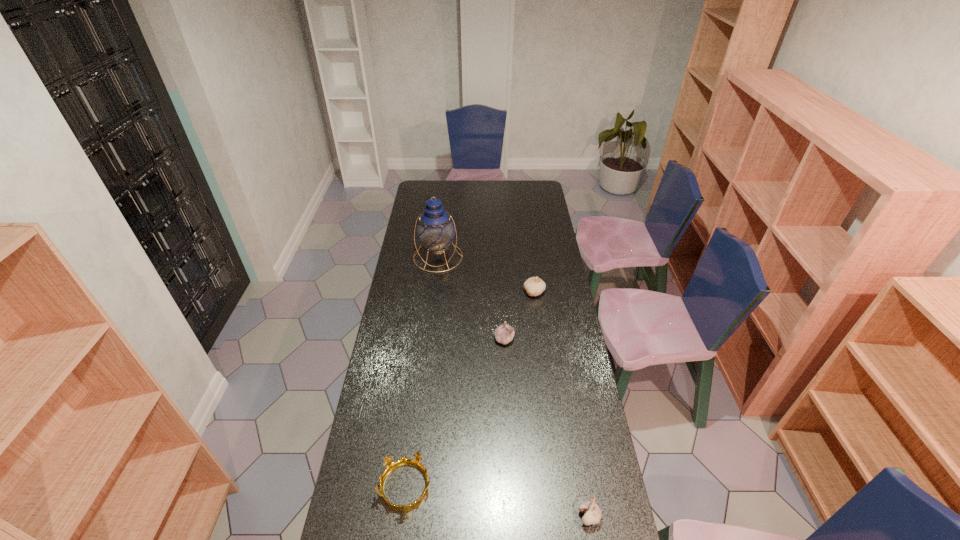
Select which object appears as the third closest to the crown. Please provide its 2D coordinates. Your answer should be formatted as a tuple, i.e. [(x, y)], where the tuple contains the x and y coordinates of a point satisfying the conditions above.

[(534, 286)]

Identify which garlic is the closest to the lantern. Please provide its 2D coordinates. Your answer should be formatted as a tuple, i.e. [(x, y)], where the tuple contains the x and y coordinates of a point satisfying the conditions above.

[(534, 286)]

Find the location of `garlic that can be found as the second closest to the farthest garlic`. garlic that can be found as the second closest to the farthest garlic is located at coordinates (592, 514).

In order to click on blank space that satisfies the following two spatial constraints: 1. on the front-facing side of the farthest object; 2. on the right side of the farthest garlic in this screenshot , I will do `click(434, 292)`.

Identify the location of free space that satisfies the following two spatial constraints: 1. on the front-facing side of the third farthest object; 2. on the left side of the lantern. This screenshot has width=960, height=540. (428, 339).

I want to click on vacant point that satisfies the following two spatial constraints: 1. on the front-facing side of the lantern; 2. on the left side of the fourth tallest object, so click(x=408, y=516).

You are a GUI agent. You are given a task and a screenshot of the screen. Output one action in this format:
    pyautogui.click(x=<x>, y=<y>)
    Task: Click on the free spot that satisfies the following two spatial constraints: 1. on the back side of the second farthest garlic; 2. on the left side of the crown
    The height and width of the screenshot is (540, 960).
    Given the screenshot: What is the action you would take?
    pyautogui.click(x=424, y=339)